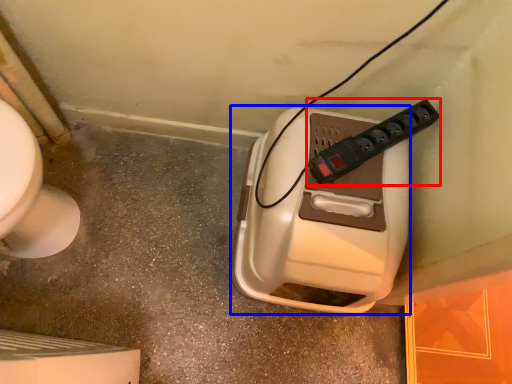
Question: Among these objects, which one is farthest to the camera, power plugs and sockets (highlighted by a red box) or hand dryer (highlighted by a blue box)?

Choices:
 (A) power plugs and sockets
 (B) hand dryer

Answer: (A)